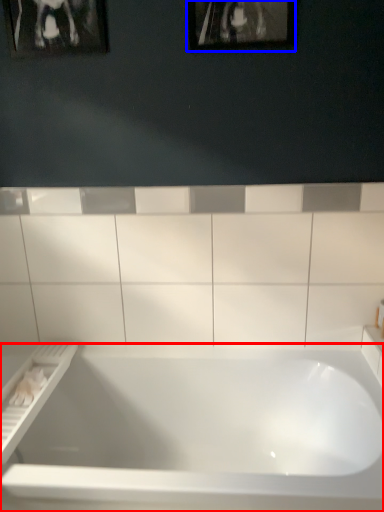
Question: Among these objects, which one is nearest to the camera, bathtub (highlighted by a red box) or picture frame (highlighted by a blue box)?

Choices:
 (A) bathtub
 (B) picture frame

Answer: (A)